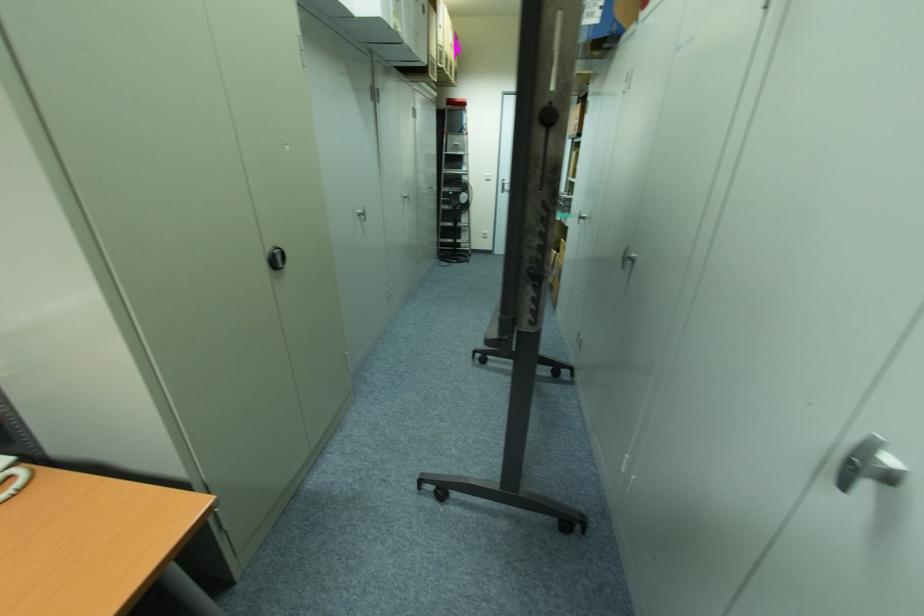
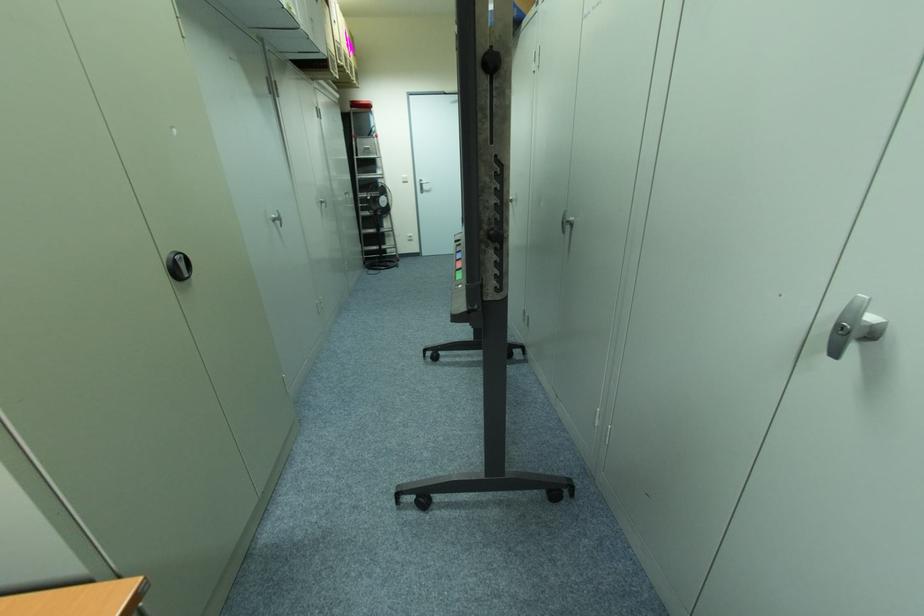
The point at (281, 257) is marked in the first image. Where is the corresponding point in the second image?

(181, 265)